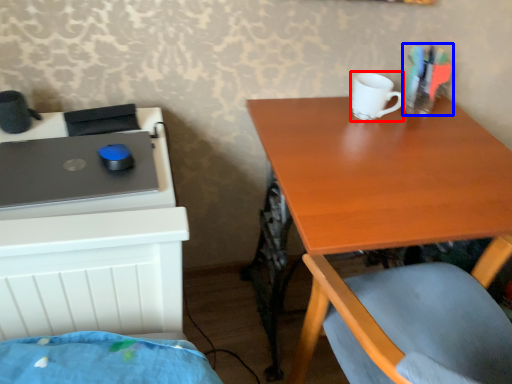
Question: Which point is further to the camera, mug (highlighted by a red box) or stationery (highlighted by a blue box)?

Choices:
 (A) mug
 (B) stationery

Answer: (B)